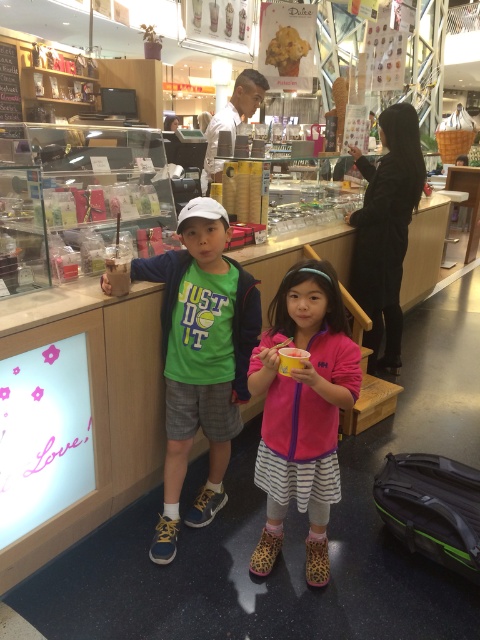
Question: Which of these objects is positioned farthest from the green fabric shirt at center?

Choices:
 (A) metallic gold frame at upper left
 (B) pink fleece jacket at center

Answer: (A)

Question: Can you confirm if green fabric shirt at center is positioned above pink fleece jacket at center?

Choices:
 (A) yes
 (B) no

Answer: (A)

Question: Is green fabric shirt at center wider than metallic gold frame at upper left?

Choices:
 (A) no
 (B) yes

Answer: (B)

Question: Which of the following is the farthest from the observer?

Choices:
 (A) (166, 346)
 (B) (4, 92)
 (C) (288, 464)

Answer: (B)

Question: Which object is closer to the camera taking this photo?

Choices:
 (A) pink fleece jacket at center
 (B) green fabric shirt at center

Answer: (A)

Question: Where is pink fleece jacket at center located in relation to metallic gold frame at upper left in the image?

Choices:
 (A) right
 (B) left

Answer: (A)